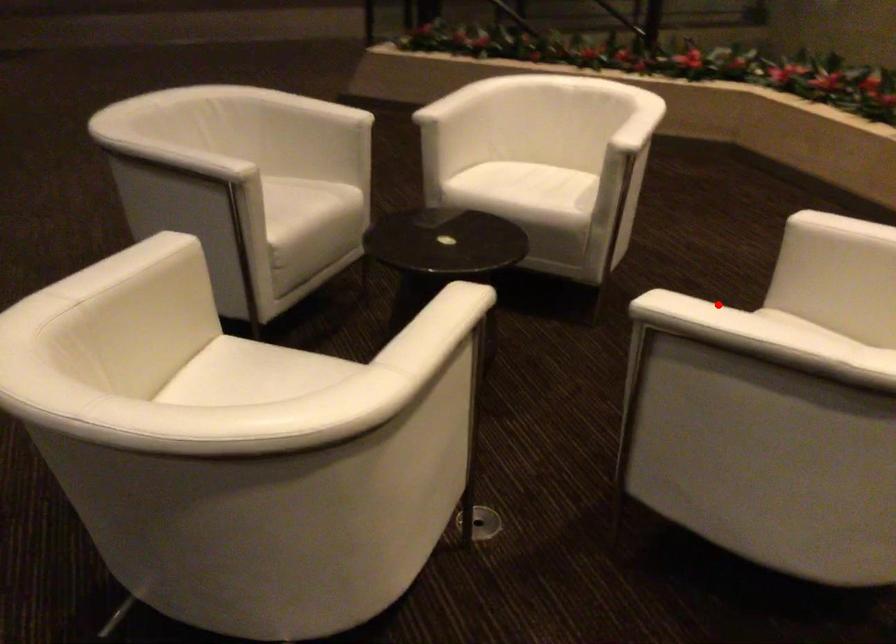
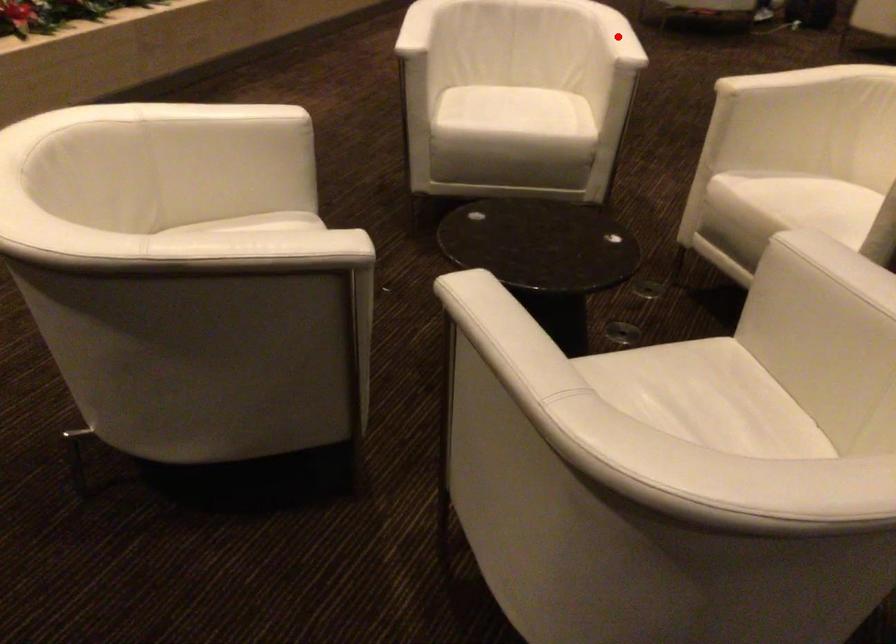
I am providing you with two images of the same scene from different viewpoints. A red point is marked on the first image and another point is marked on the second image. Does the point marked in image1 correspond to the same location as the one in image2?

Yes